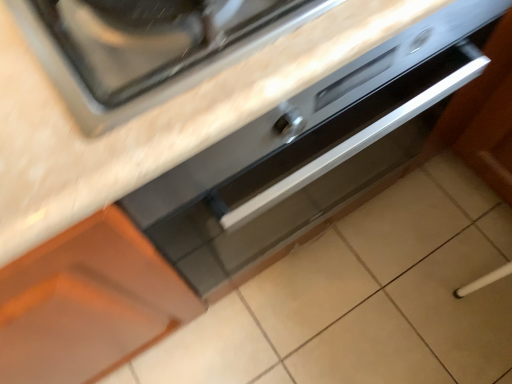
The width and height of the screenshot is (512, 384). I want to click on free location to the left of beige ceramic tile at lower right, so point(375,312).